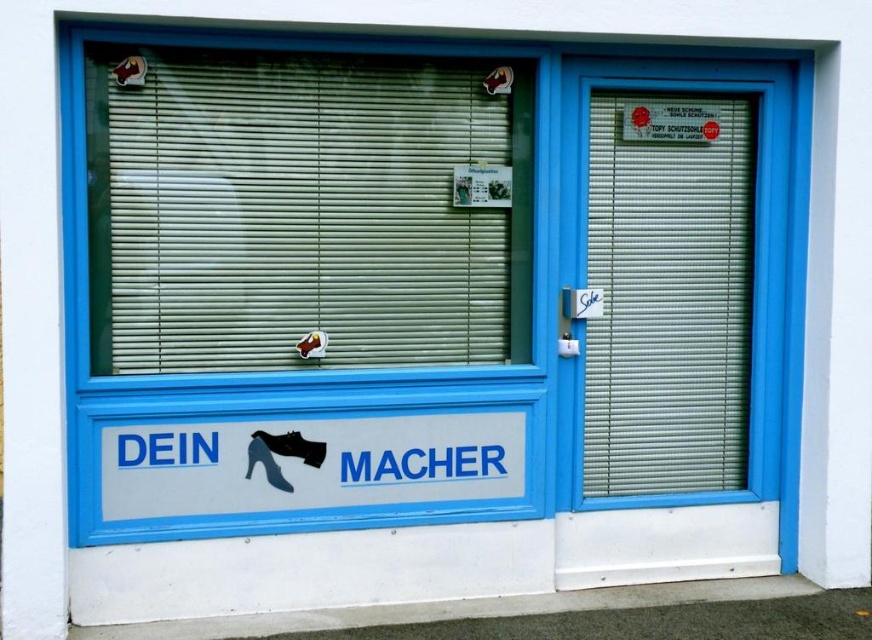
Question: Can you confirm if green matte blinds at center is positioned above white plastic shutter at right?

Choices:
 (A) yes
 (B) no

Answer: (A)

Question: Is green matte blinds at center above white plastic shutter at right?

Choices:
 (A) no
 (B) yes

Answer: (B)

Question: Which point is farther to the camera?

Choices:
 (A) green matte blinds at center
 (B) white plastic shutter at right

Answer: (B)

Question: Is green matte blinds at center further to the viewer compared to white plastic shutter at right?

Choices:
 (A) yes
 (B) no

Answer: (B)